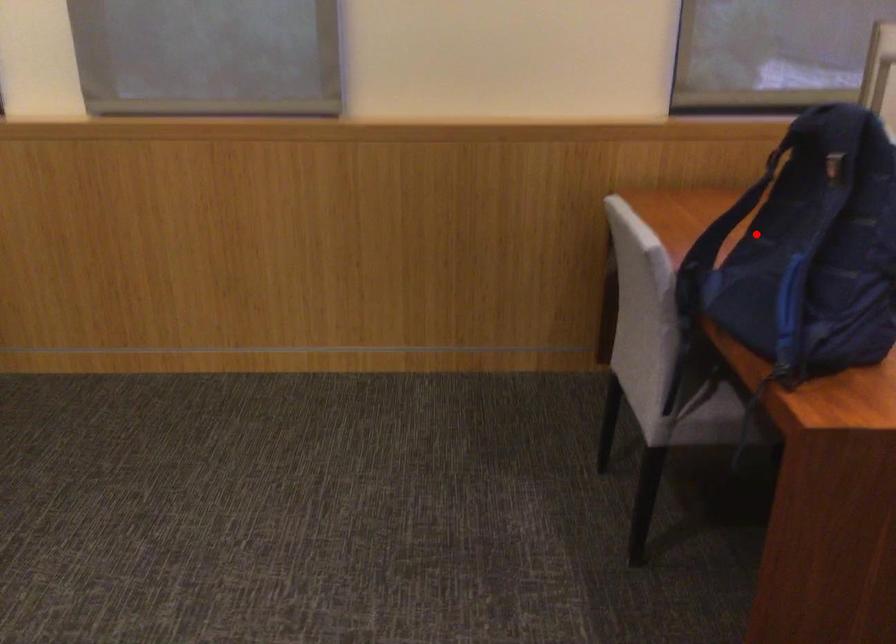
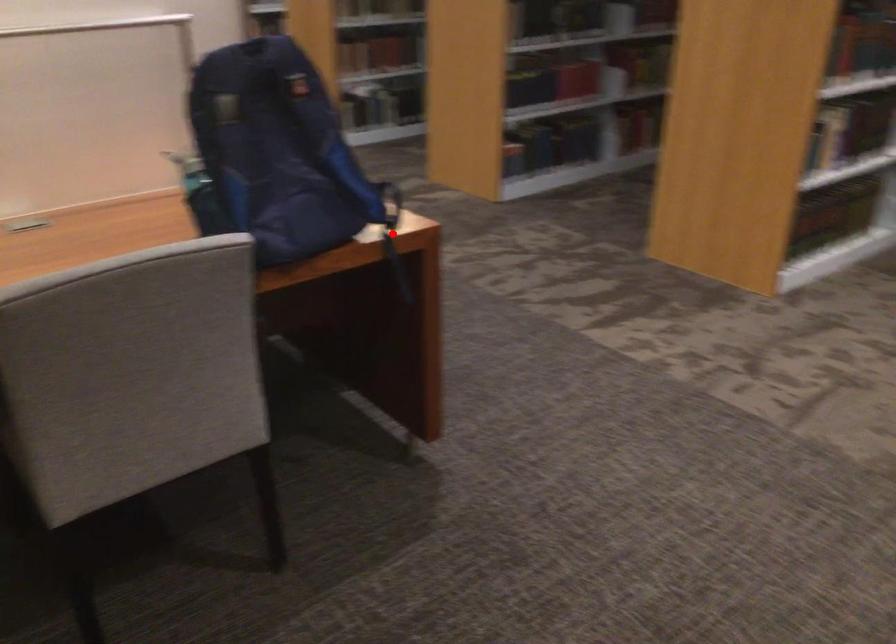
Consider the image. I am providing you with two images of the same scene from different viewpoints. A red point is marked on the first image and another point is marked on the second image. Is the red point in image1 aligned with the point shown in image2?

No